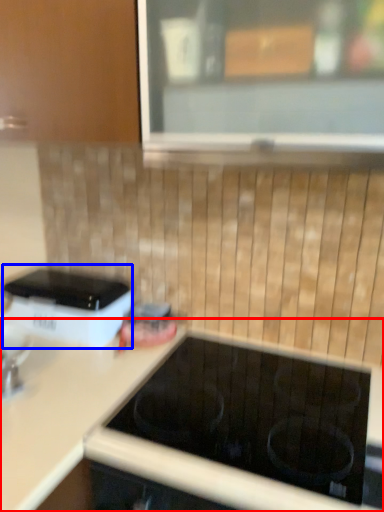
Question: Which object is further to the camera taking this photo, countertop (highlighted by a red box) or home appliance (highlighted by a blue box)?

Choices:
 (A) countertop
 (B) home appliance

Answer: (B)